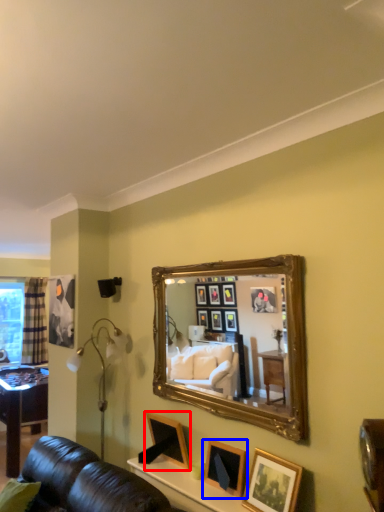
Question: Which object appears closest to the camera in this image, picture frame (highlighted by a red box) or picture frame (highlighted by a blue box)?

Choices:
 (A) picture frame
 (B) picture frame

Answer: (B)